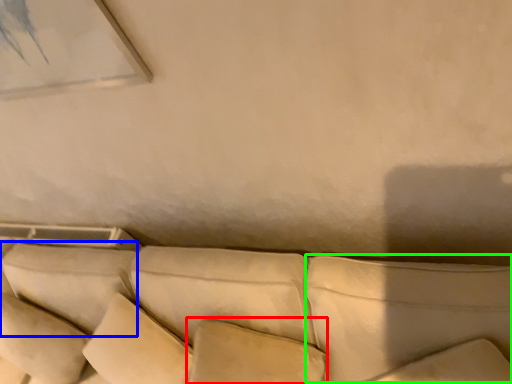
Question: Which object is the closest to the pillow (highlighted by a red box)? Choose among these: pillow (highlighted by a blue box) or pillow (highlighted by a green box).

Choices:
 (A) pillow
 (B) pillow

Answer: (B)